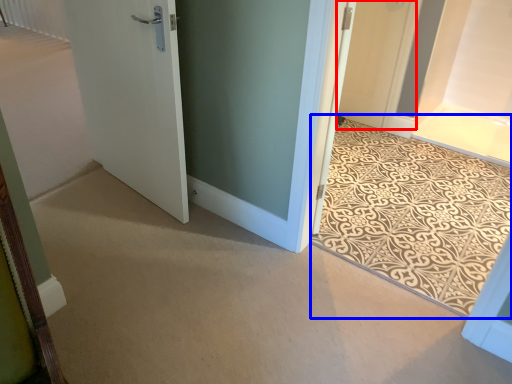
Question: Which object appears farthest to the camera in this image, door (highlighted by a red box) or doormat (highlighted by a blue box)?

Choices:
 (A) door
 (B) doormat

Answer: (A)